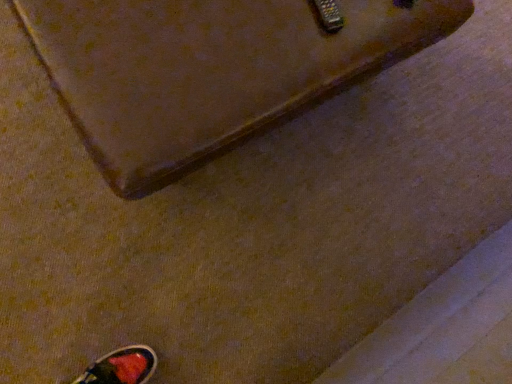
Describe the element at coordinates (210, 70) in the screenshot. The width and height of the screenshot is (512, 384). I see `leather suitcase at upper center` at that location.

Find the location of `leather suitcase at upper center`. leather suitcase at upper center is located at coordinates (210, 70).

The image size is (512, 384). In order to click on leather suitcase at upper center in this screenshot , I will do `click(210, 70)`.